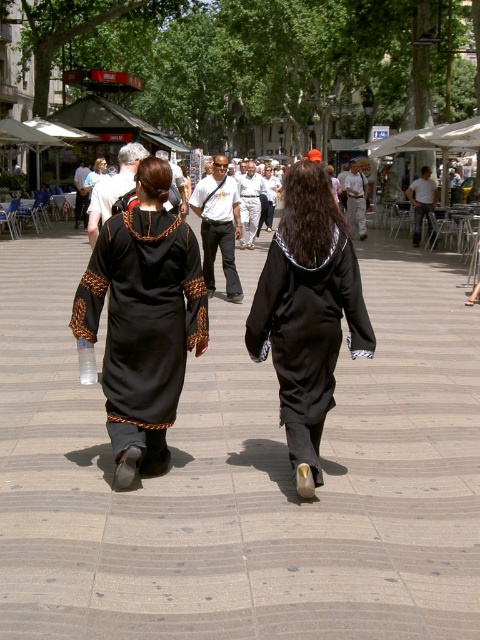
You are a photographer trying to capture a candid shot of both the white cotton shirt at center and the black matte robe at center in the same frame. Considering their sizes, which one should you focus on to ensure both are visible without zooming in or out?

The white cotton shirt at center is bigger than the black matte robe at center, so focusing on the larger white cotton shirt at center will allow both to be visible in the frame without needing to adjust the zoom.

You are standing in the city square and see the point marked at coordinates (218, 225). What object is located at that point?

The white cotton shirt at center is located at the point marked at coordinates (218, 225).

Based on the photo, you are a photographer standing in the square and want to capture both the black woven dress at center and the black cotton robe at center in a single shot. Which one should you focus on first to ensure both are in frame?

The black woven dress at center is located below the black cotton robe at center, so you should focus on the black cotton robe at center first to ensure both are in frame.